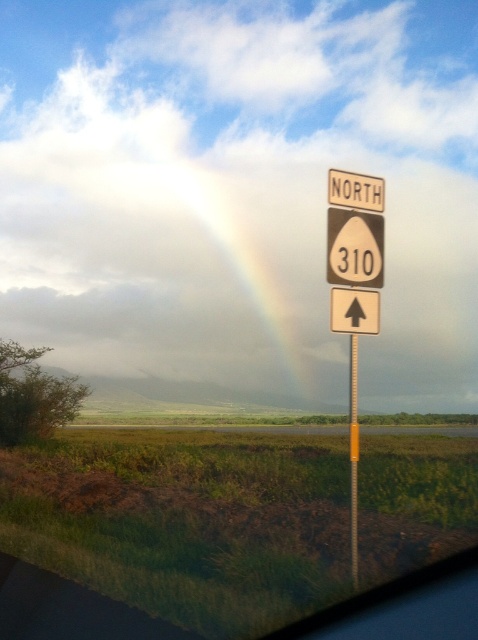
Question: Is brown paper speed limit sign at upper right closer to camera compared to white plastic arrow at center?

Choices:
 (A) yes
 (B) no

Answer: (A)

Question: Which point appears farthest from the camera in this image?

Choices:
 (A) (336, 182)
 (B) (358, 449)
 (C) (338, 296)

Answer: (A)

Question: Is white plastic arrow at center above white plastic sign at upper center?

Choices:
 (A) yes
 (B) no

Answer: (B)

Question: Which point appears farthest from the camera in this image?

Choices:
 (A) pyautogui.click(x=360, y=204)
 (B) pyautogui.click(x=350, y=561)

Answer: (A)

Question: Estimate the real-world distances between objects in this image. Which object is farther from the white plastic sign at upper center?

Choices:
 (A) yellow plastic pole at right
 (B) white plastic arrow at center

Answer: (A)

Question: Can you confirm if brown paper speed limit sign at upper right is positioned to the left of white plastic arrow at center?

Choices:
 (A) no
 (B) yes

Answer: (A)